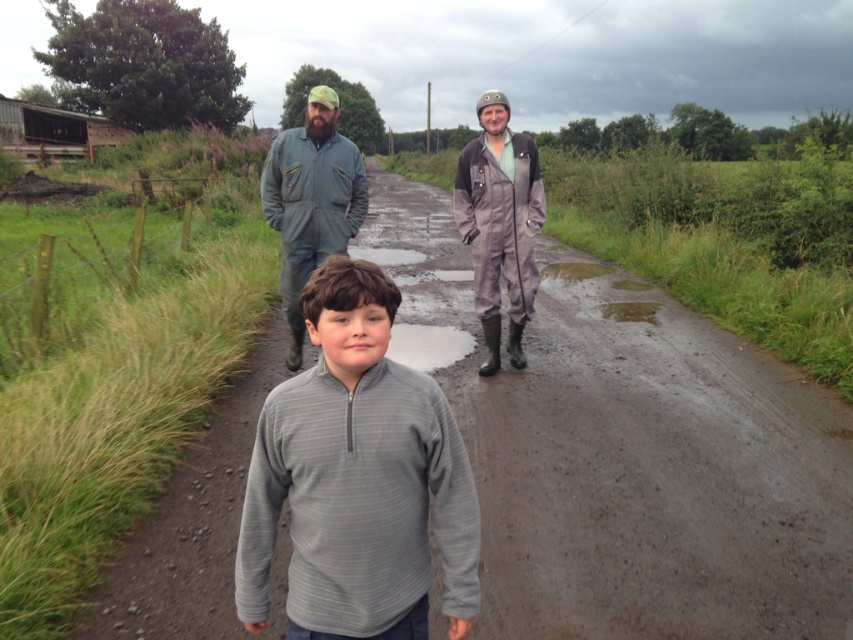
Which of these two, gray matte coveralls at center or white matte puddle at center, stands taller?

With more height is gray matte coveralls at center.

Which is more to the left, gray matte coveralls at center or white matte puddle at center?

Positioned to the left is white matte puddle at center.

Between point (505, 282) and point (415, 323), which one is positioned in front?

Point (505, 282)

Find the location of a particular element. The height and width of the screenshot is (640, 853). gray matte coveralls at center is located at coordinates (498, 224).

Consider the image. Does gray asphalt road at center have a greater height compared to gray fleece at center?

Correct, gray asphalt road at center is much taller as gray fleece at center.

From the picture: Between gray asphalt road at center and gray fleece at center, which one appears on the right side from the viewer's perspective?

gray asphalt road at center

Where is `gray asphalt road at center`? The height and width of the screenshot is (640, 853). gray asphalt road at center is located at coordinates (630, 452).

The width and height of the screenshot is (853, 640). I want to click on gray asphalt road at center, so click(x=630, y=452).

The width and height of the screenshot is (853, 640). What do you see at coordinates (357, 480) in the screenshot? I see `gray fleece at center` at bounding box center [357, 480].

Which of these two, gray fleece at center or green fabric jumpsuit at center, stands shorter?

Standing shorter between the two is gray fleece at center.

Does point (347, 522) come farther from viewer compared to point (305, 173)?

That is False.

Image resolution: width=853 pixels, height=640 pixels. Find the location of `gray fleece at center`. gray fleece at center is located at coordinates [357, 480].